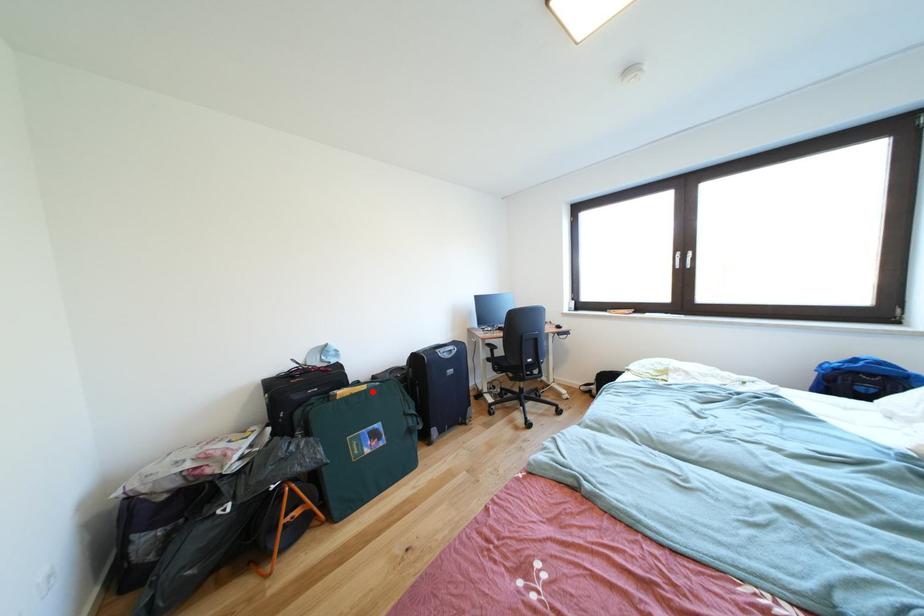
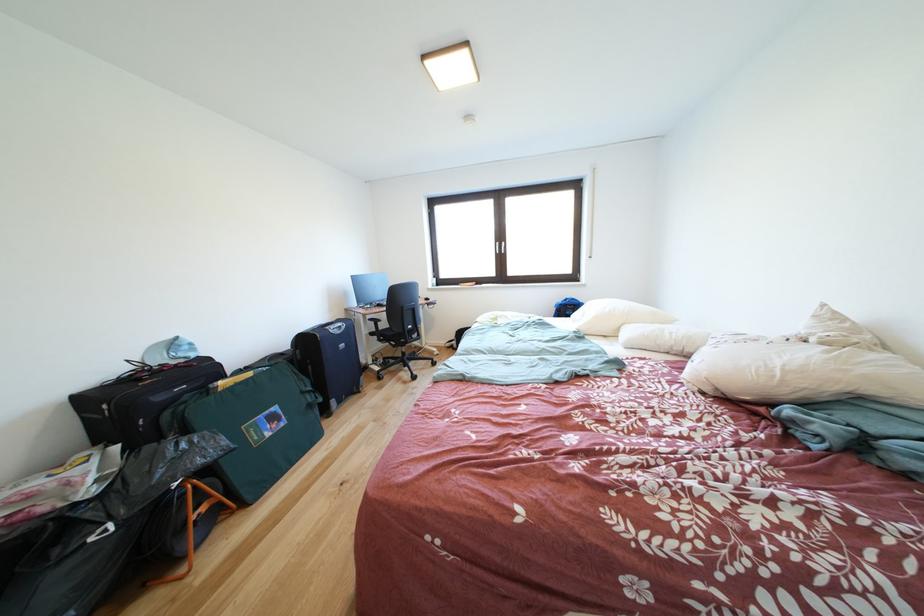
Locate, in the second image, the point that corresponds to the highlighted location in the first image.

(259, 379)